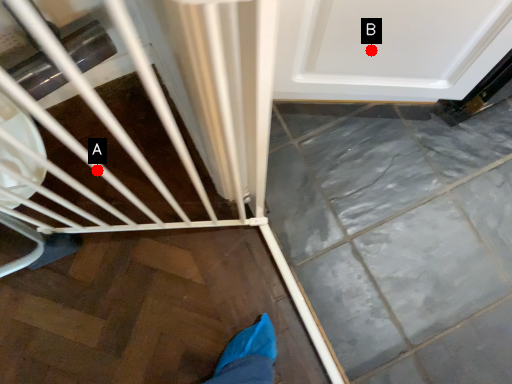
Question: Two points are circled on the image, labeled by A and B beside each circle. Among these points, which one is farthest from the camera?

Choices:
 (A) A is further
 (B) B is further

Answer: (A)